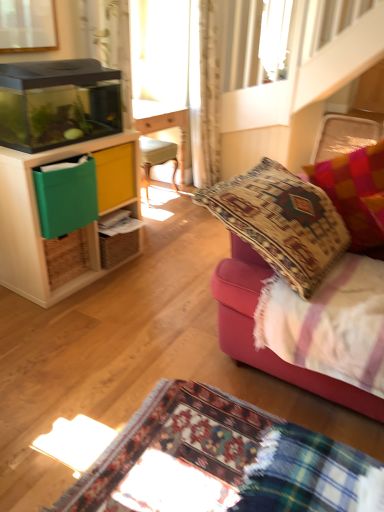
Find the location of a particular element. The height and width of the screenshot is (512, 384). free space to the left of velvet cushion at right is located at coordinates (137, 350).